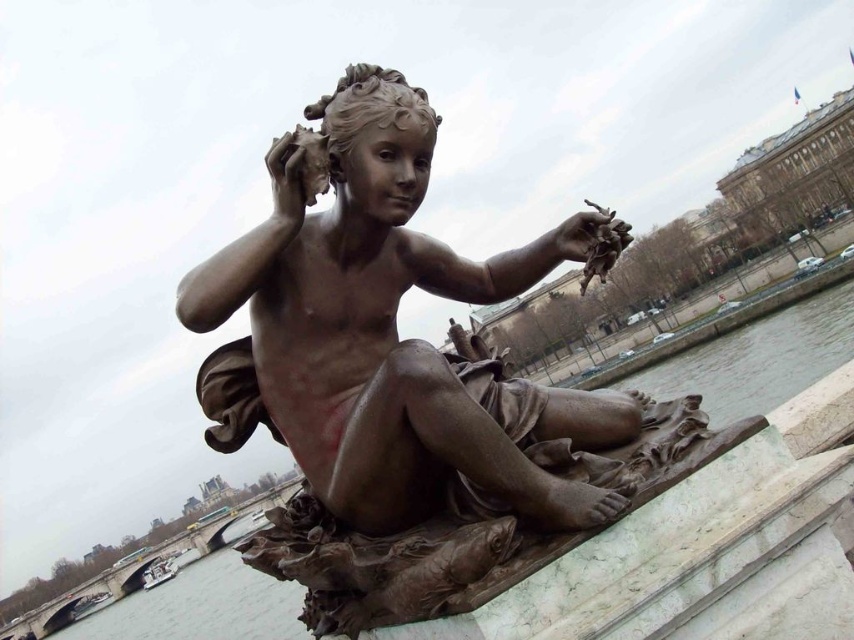
Question: Which point appears farthest from the camera in this image?

Choices:
 (A) (759, 323)
 (B) (301, 212)

Answer: (A)

Question: Does bronze statue at center appear on the right side of bronze water at statue center?

Choices:
 (A) no
 (B) yes

Answer: (B)

Question: Is bronze statue at center to the left of bronze water at statue center from the viewer's perspective?

Choices:
 (A) no
 (B) yes

Answer: (A)

Question: Does bronze statue at center appear on the right side of bronze water at statue center?

Choices:
 (A) no
 (B) yes

Answer: (B)